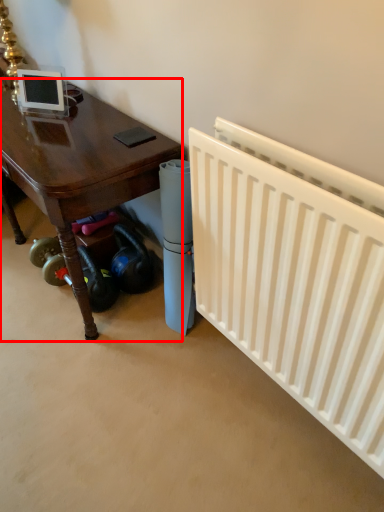
Question: Considering the relative positions of table (annotated by the red box) and radiator in the image provided, where is table (annotated by the red box) located with respect to the staircase?

Choices:
 (A) right
 (B) left

Answer: (B)